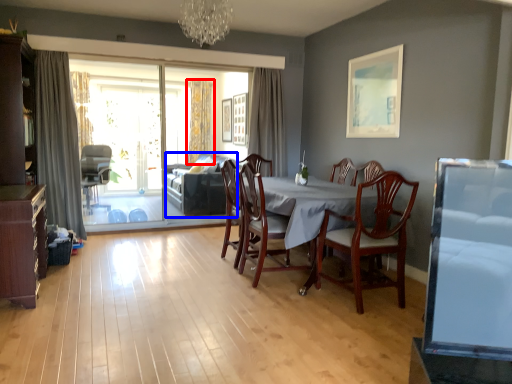
Question: Among these objects, which one is nearest to the camera, curtain (highlighted by a red box) or couch (highlighted by a blue box)?

Choices:
 (A) curtain
 (B) couch

Answer: (B)